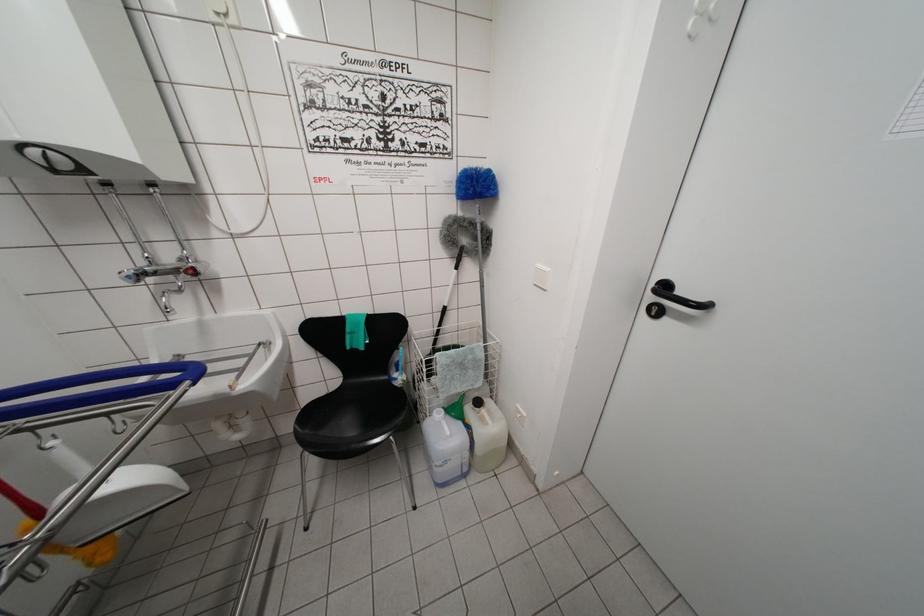
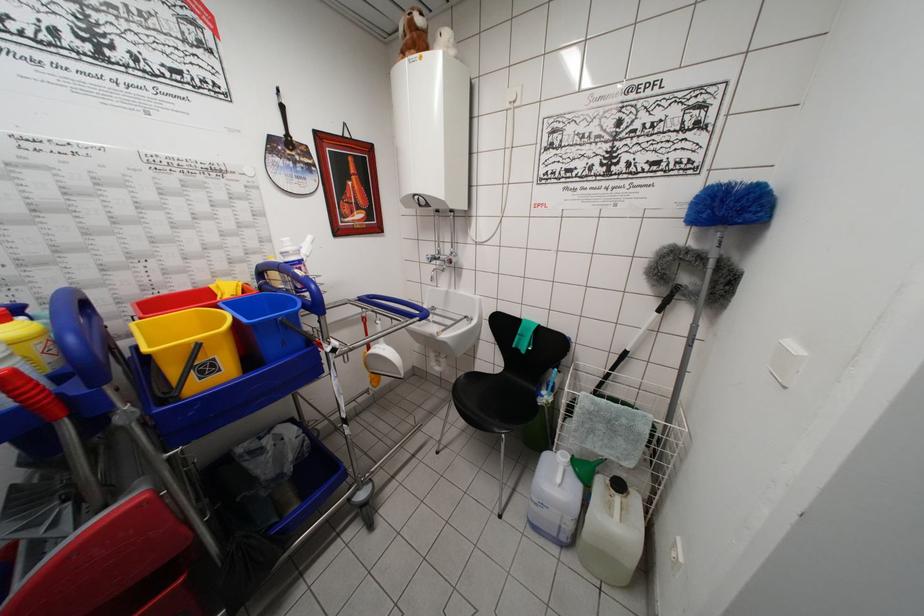
The point at (444, 314) is marked in the first image. Where is the corresponding point in the second image?

(624, 358)